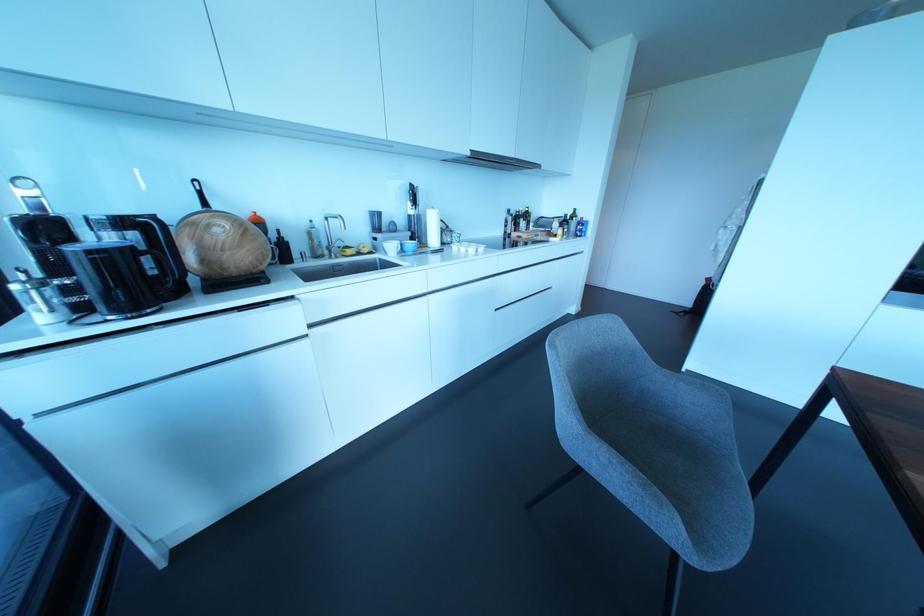
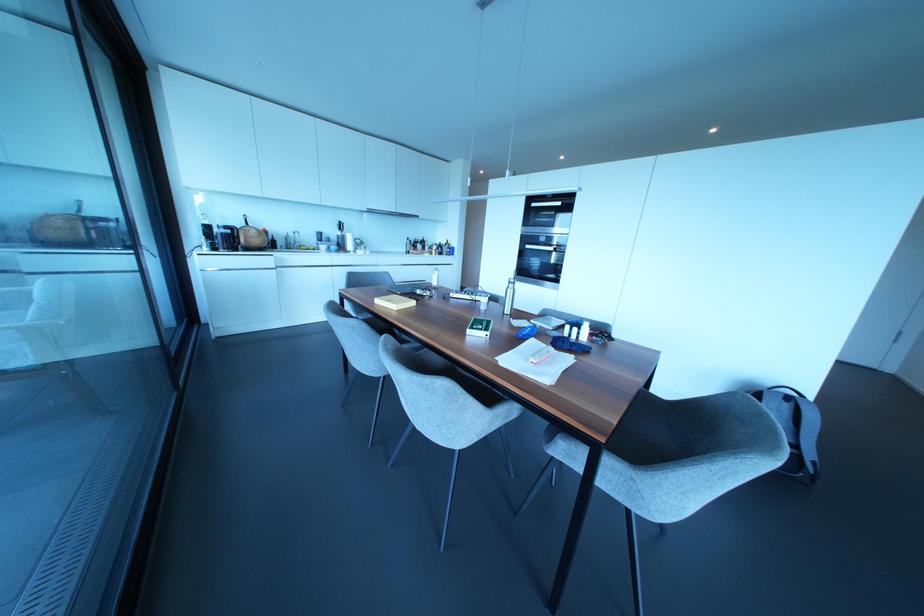
The images are taken continuously from a first-person perspective. In which direction are you moving?

The movement direction of the cameraman is right, backward.